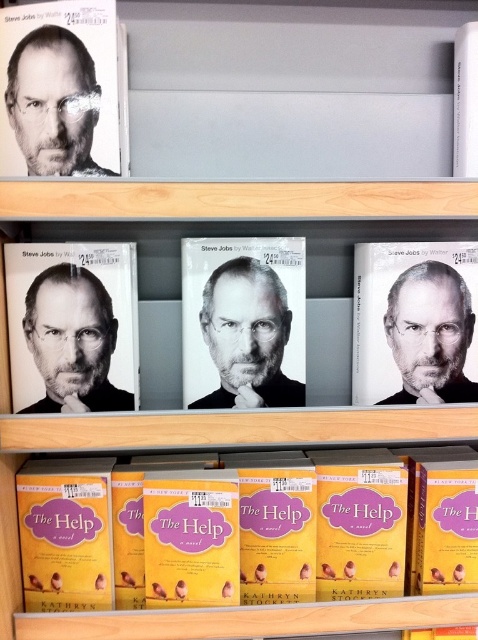
Question: Which object appears farthest from the camera in this image?

Choices:
 (A) matte black book cover at center
 (B) matte black book cover at upper left

Answer: (A)

Question: Is yellow matte book at center closer to the viewer compared to black paper book at center?

Choices:
 (A) yes
 (B) no

Answer: (B)

Question: Estimate the real-world distances between objects in this image. Which object is farther from the black paper book at center?

Choices:
 (A) yellow paperbacks at lower center
 (B) yellow matte book at center

Answer: (B)

Question: Is yellow matte book at lower left to the right of black paper book at center from the viewer's perspective?

Choices:
 (A) no
 (B) yes

Answer: (A)

Question: Which of the following is the farthest from the observer?

Choices:
 (A) black paper book at center
 (B) yellow matte book at lower left
 (C) matte black book cover at center

Answer: (C)

Question: Can you confirm if yellow matte book at lower left is wider than black paper book at center?

Choices:
 (A) yes
 (B) no

Answer: (B)